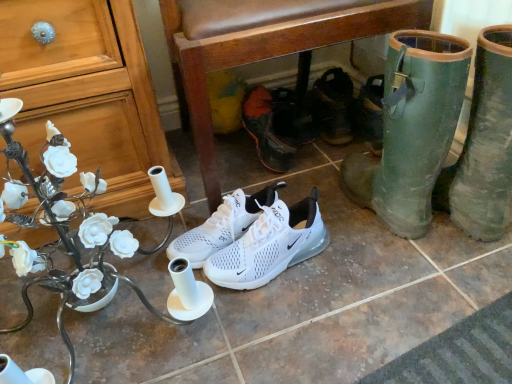
Find the location of a particular element. spots to the right of white mesh sneakers at center, the 4th footwear from the back is located at coordinates (355, 260).